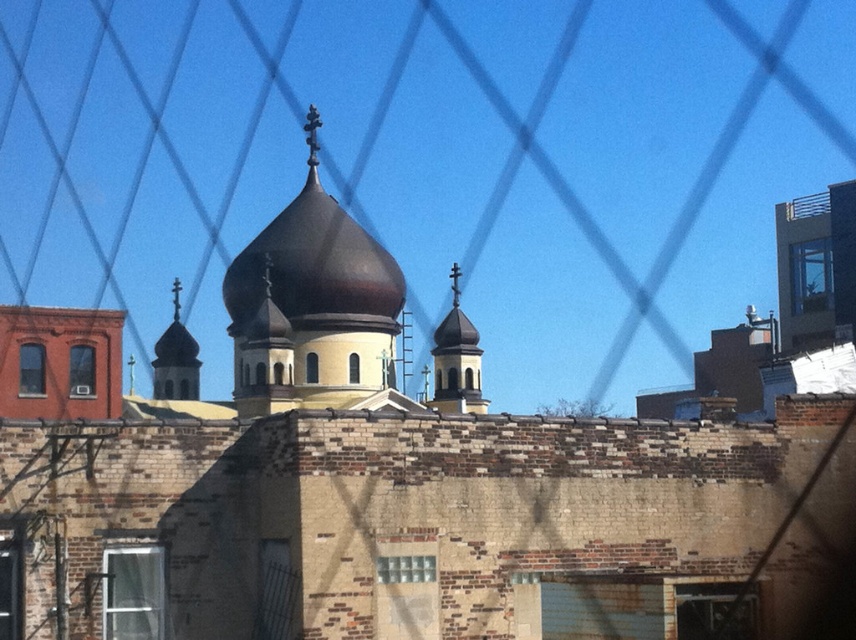
Does shiny brown dome at center appear under matte gold dome at left?

No.

Does shiny brown dome at center have a lesser height compared to matte gold dome at left?

No.

Between point (383, 273) and point (155, 371), which one is positioned behind?

Positioned behind is point (155, 371).

I want to click on shiny brown dome at center, so click(314, 266).